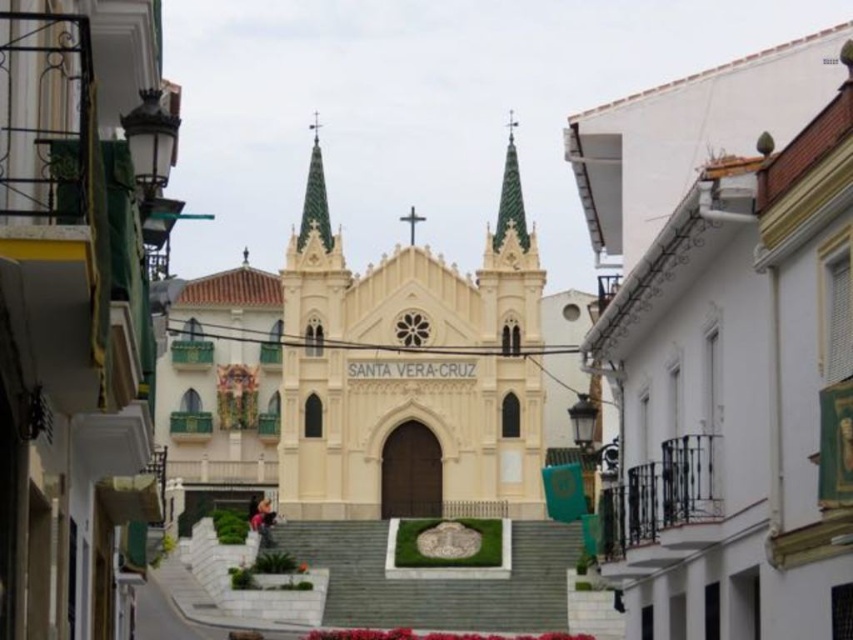
Between white stone church at center and green textured spire at center, which one appears on the right side from the viewer's perspective?

Positioned to the right is green textured spire at center.

Is point (344, 310) farther from viewer compared to point (512, 202)?

No, it is not.

Find the location of `white stone church at center`. white stone church at center is located at coordinates (399, 380).

Between gray concrete stairs at center and gold textured spire at center, which one has more height?

With more height is gold textured spire at center.

Is gray concrete stairs at center to the right of gold textured spire at center from the viewer's perspective?

Indeed, gray concrete stairs at center is positioned on the right side of gold textured spire at center.

Locate an element on the screen. The width and height of the screenshot is (853, 640). gray concrete stairs at center is located at coordinates (436, 579).

You are a GUI agent. You are given a task and a screenshot of the screen. Output one action in this format:
    pyautogui.click(x=<x>, y=<y>)
    Task: Click on the gray concrete stairs at center
    This screenshot has width=853, height=640.
    Given the screenshot: What is the action you would take?
    pyautogui.click(x=436, y=579)

Does white matte building at center have a greater height compared to green textured spire at center?

Correct, white matte building at center is much taller as green textured spire at center.

The height and width of the screenshot is (640, 853). What do you see at coordinates (726, 342) in the screenshot?
I see `white matte building at center` at bounding box center [726, 342].

Image resolution: width=853 pixels, height=640 pixels. I want to click on white matte building at center, so click(726, 342).